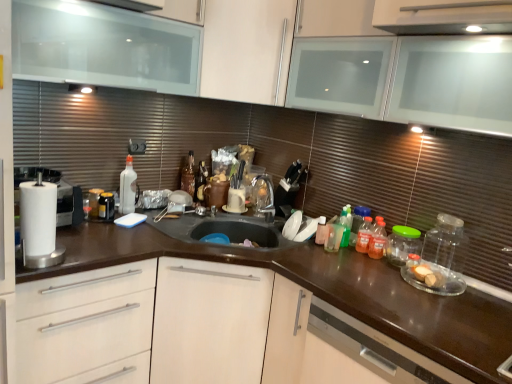
Where is `brown glossy countertop at center`? This screenshot has height=384, width=512. brown glossy countertop at center is located at coordinates (327, 291).

The width and height of the screenshot is (512, 384). What do you see at coordinates (83, 321) in the screenshot?
I see `white matte drawer at lower left` at bounding box center [83, 321].

What is the approximate height of white matte drawer at lower left?

86.33 centimeters.

What is the approximate width of satin brown dishwasher at lower right?

satin brown dishwasher at lower right is 61.39 centimeters wide.

Locate an element on the screen. The width and height of the screenshot is (512, 384). white glossy mug at center is located at coordinates (234, 201).

What do you see at coordinates (334, 234) in the screenshot? I see `translucent plastic bottle at center` at bounding box center [334, 234].

Where is `white matte cabinet at upper center, the 2th cabinetry when ordered from left to right`? Image resolution: width=512 pixels, height=384 pixels. white matte cabinet at upper center, the 2th cabinetry when ordered from left to right is located at coordinates (246, 49).

At what (x,y) coordinates should I click in order to perform the action: click on brown glossy countertop at center. Please return your answer as a coordinate pair (x, y). The width and height of the screenshot is (512, 384). Looking at the image, I should click on (327, 291).

Is white matte drawer at lower left facing towards transparent glass cabinet at upper left, acting as the first cabinetry starting from the left?

No, white matte drawer at lower left does not turn towards transparent glass cabinet at upper left, acting as the first cabinetry starting from the left.

Where is `cabinetry located in front of the white matte drawer at lower left`? This screenshot has width=512, height=384. cabinetry located in front of the white matte drawer at lower left is located at coordinates (104, 47).

Can you confirm if white matte drawer at lower left is wider than transparent glass cabinet at upper left, the 2th cabinetry when ordered from right to left?

Yes, white matte drawer at lower left is wider than transparent glass cabinet at upper left, the 2th cabinetry when ordered from right to left.

How different are the orientations of white matte drawer at lower left and transparent glass cabinet at upper left, acting as the first cabinetry starting from the left, in degrees?

2.24e-05 degrees separate the facing orientations of white matte drawer at lower left and transparent glass cabinet at upper left, acting as the first cabinetry starting from the left.

Is translucent plastic bottle at center looking in the opposite direction of white glossy mug at center?

No, translucent plastic bottle at center's orientation is not away from white glossy mug at center.

Which is in front, translucent plastic bottle at center or white glossy mug at center?

translucent plastic bottle at center is in front.

Considering the sizes of objects translucent plastic bottle at center and white glossy mug at center in the image provided, who is thinner, translucent plastic bottle at center or white glossy mug at center?

translucent plastic bottle at center.

Between translucent plastic bottle at center and white glossy mug at center, which one has more height?

With more height is translucent plastic bottle at center.

Looking at this image, from a real-world perspective, between satin brown dishwasher at lower right and white glossy mug at center, who is vertically higher?

In real-world perspective, white glossy mug at center is above.

From the picture: Is satin brown dishwasher at lower right turned away from white glossy mug at center?

No.

How many degrees apart are the facing directions of satin brown dishwasher at lower right and white glossy mug at center?

The facing directions of satin brown dishwasher at lower right and white glossy mug at center are 90 degrees apart.

In terms of width, does satin brown dishwasher at lower right look wider or thinner when compared to white glossy mug at center?

satin brown dishwasher at lower right is wider than white glossy mug at center.

Consider the image. From the image's perspective, which one is positioned higher, white glossy mug at center or white matte cabinet at upper center, the 1th cabinetry in the right-to-left sequence?

From the image's view, white matte cabinet at upper center, the 1th cabinetry in the right-to-left sequence, is above.

Are white glossy mug at center and white matte cabinet at upper center, the 2th cabinetry when ordered from left to right, located far from each other?

No, white glossy mug at center is not far from white matte cabinet at upper center, the 2th cabinetry when ordered from left to right.

In terms of size, does white glossy mug at center appear bigger or smaller than white matte cabinet at upper center, the 2th cabinetry when ordered from left to right?

Considering their sizes, white glossy mug at center takes up less space than white matte cabinet at upper center, the 2th cabinetry when ordered from left to right.

Is white glossy mug at center thinner than white matte cabinet at upper center, the 2th cabinetry when ordered from left to right?

Yes, white glossy mug at center is thinner than white matte cabinet at upper center, the 2th cabinetry when ordered from left to right.

What's the angular difference between transparent glass cabinet at upper left, the 2th cabinetry when ordered from right to left, and white matte drawer at lower left's facing directions?

The angular difference between transparent glass cabinet at upper left, the 2th cabinetry when ordered from right to left, and white matte drawer at lower left is 2.24e-05 degrees.

Which object is more forward, transparent glass cabinet at upper left, the 2th cabinetry when ordered from right to left, or white matte drawer at lower left?

transparent glass cabinet at upper left, the 2th cabinetry when ordered from right to left, is more forward.

In the scene shown: Is transparent glass cabinet at upper left, acting as the first cabinetry starting from the left, positioned beyond the bounds of white matte drawer at lower left?

Yes.

Could you tell me if transparent glass cabinet at upper left, the 2th cabinetry when ordered from right to left, is facing white matte drawer at lower left?

No, transparent glass cabinet at upper left, the 2th cabinetry when ordered from right to left, is not oriented towards white matte drawer at lower left.

Does transparent glass cabinet at upper left, acting as the first cabinetry starting from the left, have a lesser width compared to satin brown dishwasher at lower right?

Yes, transparent glass cabinet at upper left, acting as the first cabinetry starting from the left, is thinner than satin brown dishwasher at lower right.

Is transparent glass cabinet at upper left, the 2th cabinetry when ordered from right to left, oriented away from satin brown dishwasher at lower right?

No, transparent glass cabinet at upper left, the 2th cabinetry when ordered from right to left,'s orientation is not away from satin brown dishwasher at lower right.

Looking at this image, considering the positions of objects transparent glass cabinet at upper left, acting as the first cabinetry starting from the left, and satin brown dishwasher at lower right in the image provided, who is behind, transparent glass cabinet at upper left, acting as the first cabinetry starting from the left, or satin brown dishwasher at lower right?

transparent glass cabinet at upper left, acting as the first cabinetry starting from the left, is behind.

Is white matte drawer at lower left further to the viewer compared to satin brown dishwasher at lower right?

Yes, white matte drawer at lower left is further from the camera.

From the image's perspective, is white matte drawer at lower left above satin brown dishwasher at lower right?

Yes, from the image's perspective, white matte drawer at lower left is above satin brown dishwasher at lower right.

Consider the image. Is white matte drawer at lower left facing away from satin brown dishwasher at lower right?

white matte drawer at lower left is not turned away from satin brown dishwasher at lower right.

This screenshot has width=512, height=384. What are the coordinates of `drawer behind the transparent glass cabinet at upper left, the 2th cabinetry when ordered from right to left` in the screenshot? It's located at (83, 321).

The image size is (512, 384). I want to click on bottle to the right of white glossy mug at center, so click(x=334, y=234).

Estimate the real-world distances between objects in this image. Which object is further from white matte cabinet at upper center, the 1th cabinetry in the right-to-left sequence, satin brown dishwasher at lower right or white glossy mug at center?

satin brown dishwasher at lower right is further to white matte cabinet at upper center, the 1th cabinetry in the right-to-left sequence.

Estimate the real-world distances between objects in this image. Which object is further from translucent plastic bottle at center, white glossy mug at center or white matte drawer at lower left?

white matte drawer at lower left.

Looking at the image, which one is located further to white matte drawer at lower left, brown glossy countertop at center or white matte cabinet at upper center, the 2th cabinetry when ordered from left to right?

Based on the image, white matte cabinet at upper center, the 2th cabinetry when ordered from left to right, appears to be further to white matte drawer at lower left.

Considering their positions, is transparent glass cabinet at upper left, the 2th cabinetry when ordered from right to left, positioned further to white matte cabinet at upper center, the 2th cabinetry when ordered from left to right, than white matte drawer at lower left?

white matte drawer at lower left is positioned further to the anchor white matte cabinet at upper center, the 2th cabinetry when ordered from left to right.

Looking at the image, which one is located closer to white glossy mug at center, satin brown dishwasher at lower right or translucent plastic bottle at center?

Among the two, translucent plastic bottle at center is located nearer to white glossy mug at center.

Which object lies further to the anchor point white matte cabinet at upper center, the 1th cabinetry in the right-to-left sequence, white glossy mug at center or white matte drawer at lower left?

white matte drawer at lower left is positioned further to the anchor white matte cabinet at upper center, the 1th cabinetry in the right-to-left sequence.

Looking at the image, which one is located closer to white matte drawer at lower left, satin brown dishwasher at lower right or transparent glass cabinet at upper left, acting as the first cabinetry starting from the left?

satin brown dishwasher at lower right.

When comparing their distances from brown glossy countertop at center, does white glossy mug at center or white matte drawer at lower left seem closer?

white matte drawer at lower left is positioned closer to the anchor brown glossy countertop at center.

Image resolution: width=512 pixels, height=384 pixels. I want to click on countertop that lies between transparent glass cabinet at upper left, the 2th cabinetry when ordered from right to left, and satin brown dishwasher at lower right from top to bottom, so click(x=327, y=291).

Identify the location of appliance that lies between white matte cabinet at upper center, the 1th cabinetry in the right-to-left sequence, and satin brown dishwasher at lower right from top to bottom. 234,201.

This screenshot has height=384, width=512. I want to click on drawer between brown glossy countertop at center and white glossy mug at center from front to back, so click(83, 321).

Find the location of `bottle between transparent glass cabinet at upper left, the 2th cabinetry when ordered from right to left, and satin brown dishwasher at lower right vertically`. bottle between transparent glass cabinet at upper left, the 2th cabinetry when ordered from right to left, and satin brown dishwasher at lower right vertically is located at coordinates (334, 234).